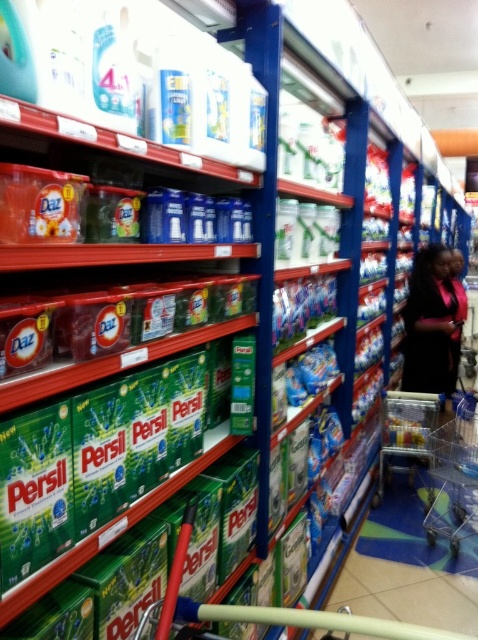
Does dark blue fabric dress at lower right appear on the right side of clear plastic shopping cart at lower right?

Correct, you'll find dark blue fabric dress at lower right to the right of clear plastic shopping cart at lower right.

Who is taller, dark blue fabric dress at lower right or clear plastic shopping cart at lower right?

dark blue fabric dress at lower right

Is point (464, 298) positioned before point (430, 435)?

No.

Find the location of a particular element. The image size is (478, 640). dark blue fabric dress at lower right is located at coordinates (433, 321).

In the scene shown: Between metallic silver shopping cart at lower right and clear plastic shopping cart at lower right, which one appears on the right side from the viewer's perspective?

From the viewer's perspective, metallic silver shopping cart at lower right appears more on the right side.

Can you confirm if metallic silver shopping cart at lower right is positioned below clear plastic shopping cart at lower right?

No, metallic silver shopping cart at lower right is not below clear plastic shopping cart at lower right.

Between point (432, 516) and point (388, 461), which one is positioned in front?

Point (432, 516) is more forward.

You are a GUI agent. You are given a task and a screenshot of the screen. Output one action in this format:
    pyautogui.click(x=<x>, y=<y>)
    Task: Click on the metallic silver shopping cart at lower right
    
    Given the screenshot: What is the action you would take?
    pyautogui.click(x=454, y=483)

Is dark blue fabric dress at lower right taller than metallic silver shopping cart at lower right?

Yes, dark blue fabric dress at lower right is taller than metallic silver shopping cart at lower right.

Between dark blue fabric dress at lower right and metallic silver shopping cart at lower right, which one appears on the right side from the viewer's perspective?

From the viewer's perspective, dark blue fabric dress at lower right appears more on the right side.

You are a GUI agent. You are given a task and a screenshot of the screen. Output one action in this format:
    pyautogui.click(x=<x>, y=<y>)
    Task: Click on the dark blue fabric dress at lower right
    Image resolution: width=478 pixels, height=640 pixels.
    Given the screenshot: What is the action you would take?
    pyautogui.click(x=433, y=321)

The image size is (478, 640). In order to click on dark blue fabric dress at lower right in this screenshot , I will do `click(433, 321)`.